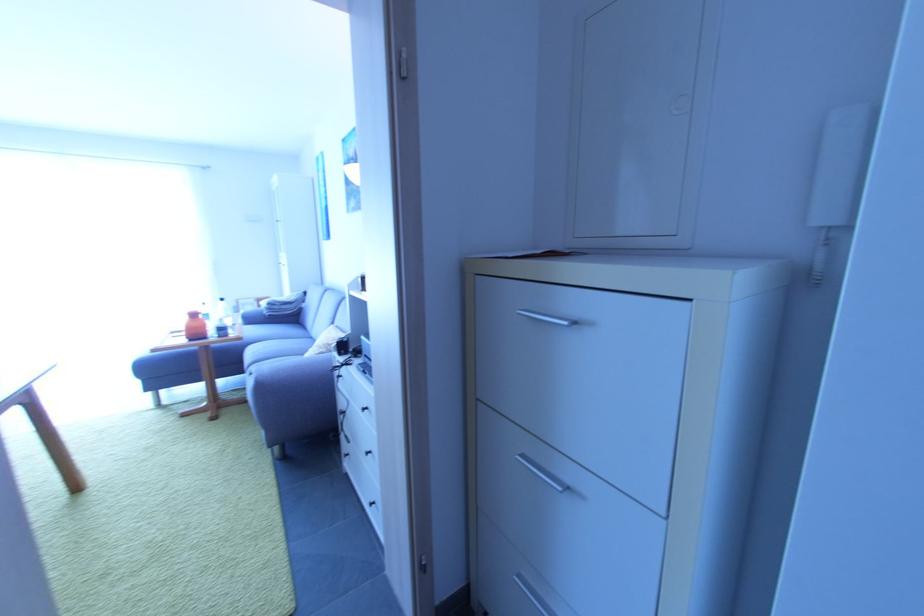
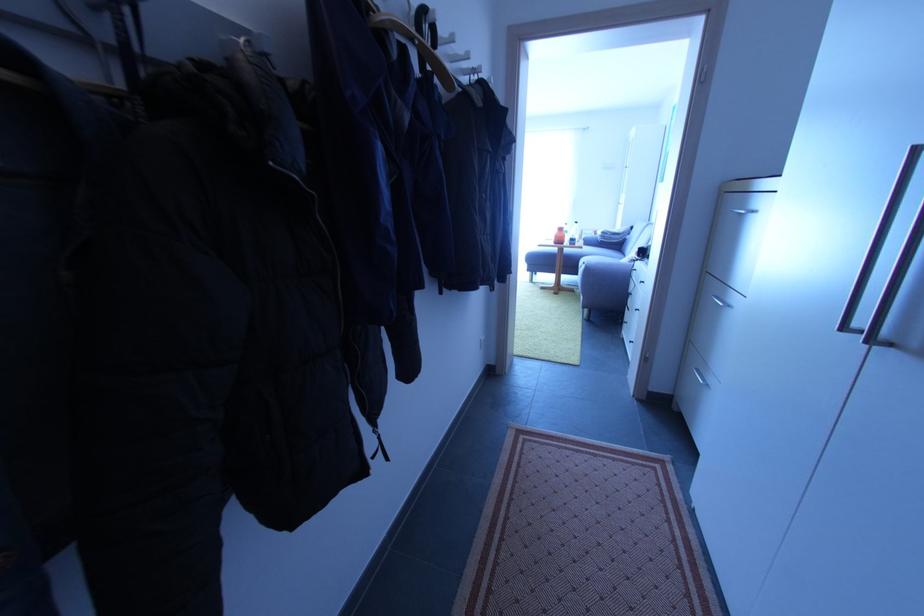
Locate, in the second image, the point that corresponds to (x=241, y=310) in the first image.

(585, 238)